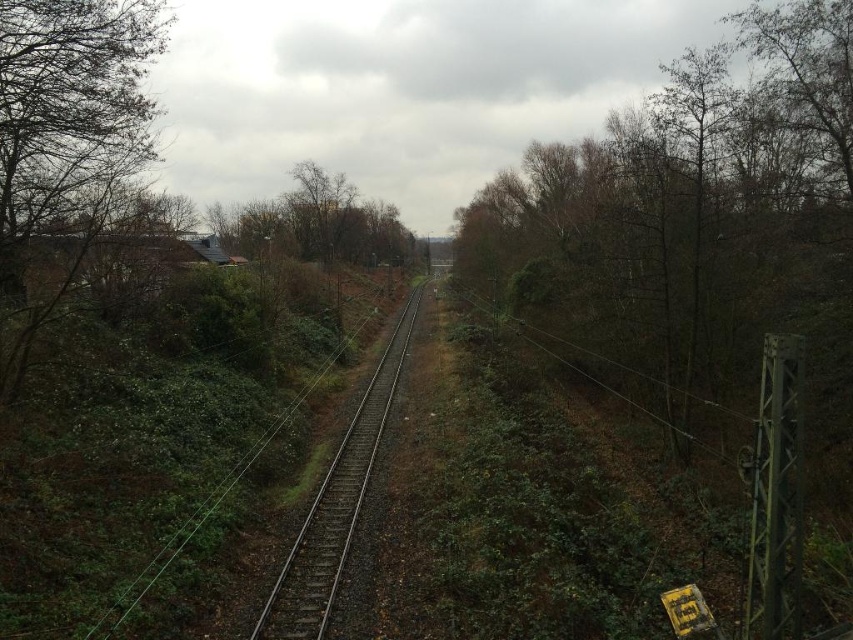
Question: Based on their relative distances, which object is nearer to the green leafy tree at left?

Choices:
 (A) brown leafy tree at right
 (B) metal train track at center

Answer: (B)

Question: Among these points, which one is farthest from the camera?

Choices:
 (A) (136, 136)
 (B) (846, 58)

Answer: (A)

Question: Can you confirm if brown leafy tree at right is positioned above metal train track at center?

Choices:
 (A) no
 (B) yes

Answer: (B)

Question: Observing the image, what is the correct spatial positioning of green leafy tree at left in reference to metal train track at center?

Choices:
 (A) below
 (B) above

Answer: (B)

Question: From the image, what is the correct spatial relationship of brown leafy tree at right in relation to metal train track at center?

Choices:
 (A) right
 (B) left

Answer: (A)

Question: Which of the following is the farthest from the observer?

Choices:
 (A) (3, 196)
 (B) (352, 474)
 (C) (785, 77)

Answer: (C)